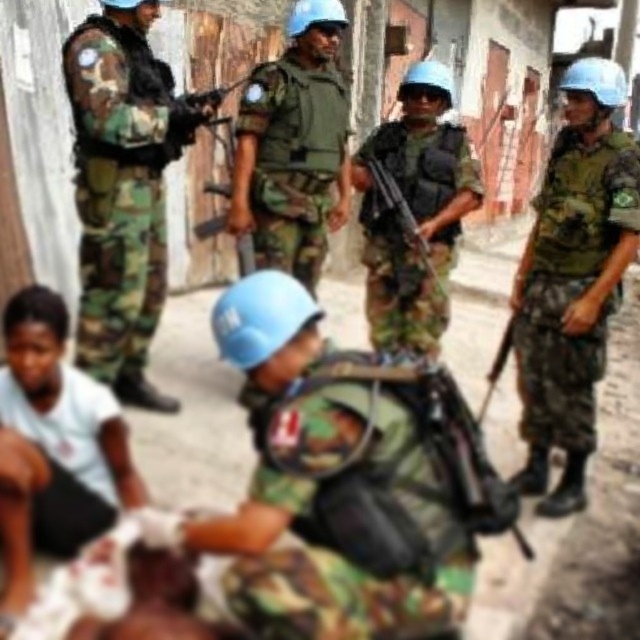
Which is in front, point (429, 522) or point (140, 234)?

Point (429, 522) is more forward.

What do you see at coordinates (328, 525) in the screenshot?
I see `camo fabric backpack at center` at bounding box center [328, 525].

Locate an element on the screen. The image size is (640, 640). camo fabric backpack at center is located at coordinates (328, 525).

Which is below, camouflage fabric uniform at center or matte black rifle at center?

matte black rifle at center is lower down.

Is camouflage fabric uniform at center taller than matte black rifle at center?

Yes.

Measure the distance between point (314, 262) and camera.

4.66 meters

Find the location of a particular element. camouflage fabric uniform at center is located at coordinates (291, 161).

Is camouflage fabric uniform at right to the right of white matte shirt at lower left from the viewer's perspective?

Indeed, camouflage fabric uniform at right is positioned on the right side of white matte shirt at lower left.

Which is more to the right, camouflage fabric uniform at right or white matte shirt at lower left?

camouflage fabric uniform at right is more to the right.

Between point (636, 160) and point (112, 502), which one is positioned behind?

The point (636, 160) is behind.

Locate an element on the screen. Image resolution: width=640 pixels, height=640 pixels. camouflage fabric uniform at right is located at coordinates (572, 282).